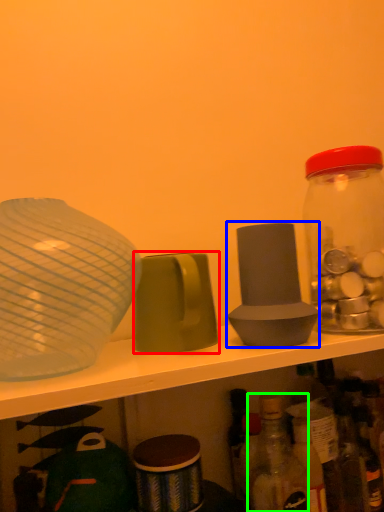
Question: Which object is positioned farthest from tableware (highlighted by a red box)? Select from tableware (highlighted by a blue box) and bottle (highlighted by a green box).

Choices:
 (A) tableware
 (B) bottle

Answer: (B)